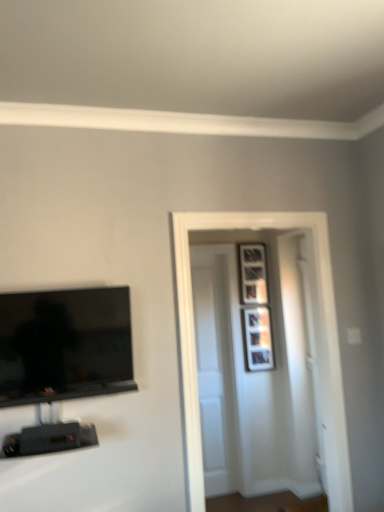
The image size is (384, 512). What do you see at coordinates (215, 369) in the screenshot?
I see `white wooden door at center, positioned as the first door in back-to-front order` at bounding box center [215, 369].

In order to face white glossy door at center, arranged as the 2th door when viewed from the back, should I rotate leftwards or rightwards?

A 9.481 degree turn to the right will do.

The height and width of the screenshot is (512, 384). Describe the element at coordinates (253, 274) in the screenshot. I see `wooden picture frame at upper right, placed as the first picture frame when sorted from top to bottom` at that location.

The image size is (384, 512). Describe the element at coordinates (258, 338) in the screenshot. I see `matte silver picture frame at upper right, which is counted as the second picture frame, starting from the top` at that location.

Where is `black glossy tv at left`? black glossy tv at left is located at coordinates pos(64,345).

Where is `white wooden door at center, positioned as the first door in back-to-front order`? white wooden door at center, positioned as the first door in back-to-front order is located at coordinates (215, 369).

Based on the photo, which object is more forward, matte silver picture frame at upper right, which is counted as the second picture frame, starting from the top, or white wooden door at center, positioned as the first door in back-to-front order?

white wooden door at center, positioned as the first door in back-to-front order, is in front.

Can you confirm if matte silver picture frame at upper right, marked as the first picture frame in a bottom-to-top arrangement, is positioned to the right of white wooden door at center, marked as the second door in a front-to-back arrangement?

Yes, matte silver picture frame at upper right, marked as the first picture frame in a bottom-to-top arrangement, is to the right of white wooden door at center, marked as the second door in a front-to-back arrangement.

Is matte silver picture frame at upper right, which is counted as the second picture frame, starting from the top, not near white wooden door at center, positioned as the first door in back-to-front order?

They are positioned close to each other.

Looking at this image, from a real-world perspective, is matte silver picture frame at upper right, marked as the first picture frame in a bottom-to-top arrangement, positioned above or below white wooden door at center, positioned as the first door in back-to-front order?

Clearly, from a real-world perspective, matte silver picture frame at upper right, marked as the first picture frame in a bottom-to-top arrangement, is above white wooden door at center, positioned as the first door in back-to-front order.

Which object is more forward, white wooden door at center, positioned as the first door in back-to-front order, or white glossy door at center, arranged as the 2th door when viewed from the back?

white glossy door at center, arranged as the 2th door when viewed from the back.

From the image's perspective, does white wooden door at center, marked as the second door in a front-to-back arrangement, appear higher than white glossy door at center, arranged as the 2th door when viewed from the back?

No, from the image's perspective, white wooden door at center, marked as the second door in a front-to-back arrangement, is not on top of white glossy door at center, arranged as the 2th door when viewed from the back.

How many degrees apart are the facing directions of white wooden door at center, positioned as the first door in back-to-front order, and white glossy door at center, arranged as the 2th door when viewed from the back?

1.2 degrees separate the facing orientations of white wooden door at center, positioned as the first door in back-to-front order, and white glossy door at center, arranged as the 2th door when viewed from the back.

From the picture: Is white wooden door at center, positioned as the first door in back-to-front order, next to white glossy door at center, the first door viewed from the front?

No, white wooden door at center, positioned as the first door in back-to-front order, is not with white glossy door at center, the first door viewed from the front.

From the picture: Can you see black glossy tv at left touching matte silver picture frame at upper right, marked as the first picture frame in a bottom-to-top arrangement?

No, black glossy tv at left is not next to matte silver picture frame at upper right, marked as the first picture frame in a bottom-to-top arrangement.

Is black glossy tv at left facing towards matte silver picture frame at upper right, marked as the first picture frame in a bottom-to-top arrangement?

No, black glossy tv at left is not turned towards matte silver picture frame at upper right, marked as the first picture frame in a bottom-to-top arrangement.

Which is more to the right, black glossy tv at left or matte silver picture frame at upper right, which is counted as the second picture frame, starting from the top?

Positioned to the right is matte silver picture frame at upper right, which is counted as the second picture frame, starting from the top.

What's the angular difference between black glossy tv at left and matte silver picture frame at upper right, which is counted as the second picture frame, starting from the top,'s facing directions?

The angle between the facing direction of black glossy tv at left and the facing direction of matte silver picture frame at upper right, which is counted as the second picture frame, starting from the top, is 4.7 degrees.

From the image's perspective, which one is positioned lower, wooden picture frame at upper right, placed as the first picture frame when sorted from top to bottom, or white wooden door at center, marked as the second door in a front-to-back arrangement?

white wooden door at center, marked as the second door in a front-to-back arrangement, is shown below in the image.

Looking at this image, which is less distant, (256, 298) or (210, 460)?

Point (256, 298) is farther from the camera than point (210, 460).

Is wooden picture frame at upper right, acting as the second picture frame starting from the bottom, facing away from white wooden door at center, marked as the second door in a front-to-back arrangement?

That's not correct — wooden picture frame at upper right, acting as the second picture frame starting from the bottom, is not looking away from white wooden door at center, marked as the second door in a front-to-back arrangement.

In the image, is wooden picture frame at upper right, acting as the second picture frame starting from the bottom, positioned in front of or behind white wooden door at center, marked as the second door in a front-to-back arrangement?

In the image, wooden picture frame at upper right, acting as the second picture frame starting from the bottom, appears behind white wooden door at center, marked as the second door in a front-to-back arrangement.

From the image's perspective, would you say white wooden door at center, positioned as the first door in back-to-front order, is shown under matte silver picture frame at upper right, which is counted as the second picture frame, starting from the top?

Indeed, from the image's perspective, white wooden door at center, positioned as the first door in back-to-front order, is shown beneath matte silver picture frame at upper right, which is counted as the second picture frame, starting from the top.

In terms of width, does white wooden door at center, marked as the second door in a front-to-back arrangement, look wider or thinner when compared to matte silver picture frame at upper right, marked as the first picture frame in a bottom-to-top arrangement?

white wooden door at center, marked as the second door in a front-to-back arrangement, is wider than matte silver picture frame at upper right, marked as the first picture frame in a bottom-to-top arrangement.

Would you say white wooden door at center, marked as the second door in a front-to-back arrangement, is inside or outside matte silver picture frame at upper right, which is counted as the second picture frame, starting from the top?

white wooden door at center, marked as the second door in a front-to-back arrangement, is not enclosed by matte silver picture frame at upper right, which is counted as the second picture frame, starting from the top.

From the image's perspective, which one is positioned higher, white wooden door at center, positioned as the first door in back-to-front order, or black glossy tv at left?

black glossy tv at left appears higher in the image.

Is point (218, 362) positioned after point (34, 345)?

Yes, it is behind point (34, 345).

Considering the positions of objects white wooden door at center, marked as the second door in a front-to-back arrangement, and black glossy tv at left in the image provided, who is more to the right, white wooden door at center, marked as the second door in a front-to-back arrangement, or black glossy tv at left?

white wooden door at center, marked as the second door in a front-to-back arrangement, is more to the right.

Does white wooden door at center, marked as the second door in a front-to-back arrangement, contain black glossy tv at left?

Definitely not — black glossy tv at left is not inside white wooden door at center, marked as the second door in a front-to-back arrangement.

Is the depth of wooden picture frame at upper right, acting as the second picture frame starting from the bottom, less than that of white glossy door at center, arranged as the 2th door when viewed from the back?

No, wooden picture frame at upper right, acting as the second picture frame starting from the bottom, is further to the viewer.

The width and height of the screenshot is (384, 512). In order to click on the 2nd picture frame above the white glossy door at center, the first door viewed from the front (from a real-world perspective) in this screenshot , I will do `click(253, 274)`.

From the image's perspective, is wooden picture frame at upper right, acting as the second picture frame starting from the bottom, above or below white glossy door at center, arranged as the 2th door when viewed from the back?

wooden picture frame at upper right, acting as the second picture frame starting from the bottom, is situated higher than white glossy door at center, arranged as the 2th door when viewed from the back, in the image.

Is white glossy door at center, arranged as the 2th door when viewed from the back, at the back of wooden picture frame at upper right, placed as the first picture frame when sorted from top to bottom?

No, wooden picture frame at upper right, placed as the first picture frame when sorted from top to bottom,'s orientation is not away from white glossy door at center, arranged as the 2th door when viewed from the back.

At what (x,y) coordinates should I click in order to perform the action: click on door below the matte silver picture frame at upper right, which is counted as the second picture frame, starting from the top (from the image's perspective). Please return your answer as a coordinate pair (x, y). Looking at the image, I should click on (215, 369).

This screenshot has height=512, width=384. What are the coordinates of `door above the white wooden door at center, marked as the second door in a front-to-back arrangement (from the image's perspective)` in the screenshot? It's located at (193, 317).

When comparing their distances from white wooden door at center, positioned as the first door in back-to-front order, does black glossy tv at left or matte silver picture frame at upper right, which is counted as the second picture frame, starting from the top, seem closer?

matte silver picture frame at upper right, which is counted as the second picture frame, starting from the top, is positioned closer to the anchor white wooden door at center, positioned as the first door in back-to-front order.

Based on their spatial positions, is white wooden door at center, marked as the second door in a front-to-back arrangement, or white glossy door at center, arranged as the 2th door when viewed from the back, closer to wooden picture frame at upper right, placed as the first picture frame when sorted from top to bottom?

The object closer to wooden picture frame at upper right, placed as the first picture frame when sorted from top to bottom, is white wooden door at center, marked as the second door in a front-to-back arrangement.

When comparing their distances from black glossy tv at left, does wooden picture frame at upper right, acting as the second picture frame starting from the bottom, or matte silver picture frame at upper right, which is counted as the second picture frame, starting from the top, seem closer?

matte silver picture frame at upper right, which is counted as the second picture frame, starting from the top, is positioned closer to the anchor black glossy tv at left.

From the image, which object appears to be nearer to black glossy tv at left, matte silver picture frame at upper right, which is counted as the second picture frame, starting from the top, or white glossy door at center, the first door viewed from the front?

white glossy door at center, the first door viewed from the front, is positioned closer to the anchor black glossy tv at left.

In the scene shown: Considering their positions, is matte silver picture frame at upper right, which is counted as the second picture frame, starting from the top, positioned closer to wooden picture frame at upper right, placed as the first picture frame when sorted from top to bottom, than white glossy door at center, the first door viewed from the front?

matte silver picture frame at upper right, which is counted as the second picture frame, starting from the top, is positioned closer to the anchor wooden picture frame at upper right, placed as the first picture frame when sorted from top to bottom.

From the image, which object appears to be nearer to white wooden door at center, marked as the second door in a front-to-back arrangement, black glossy tv at left or wooden picture frame at upper right, acting as the second picture frame starting from the bottom?

The object closer to white wooden door at center, marked as the second door in a front-to-back arrangement, is wooden picture frame at upper right, acting as the second picture frame starting from the bottom.

Looking at the image, which one is located further to wooden picture frame at upper right, placed as the first picture frame when sorted from top to bottom, black glossy tv at left or matte silver picture frame at upper right, marked as the first picture frame in a bottom-to-top arrangement?

black glossy tv at left is positioned further to the anchor wooden picture frame at upper right, placed as the first picture frame when sorted from top to bottom.

Which object lies further to the anchor point black glossy tv at left, white glossy door at center, arranged as the 2th door when viewed from the back, or wooden picture frame at upper right, acting as the second picture frame starting from the bottom?

wooden picture frame at upper right, acting as the second picture frame starting from the bottom, is further to black glossy tv at left.

Locate an element on the screen. Image resolution: width=384 pixels, height=512 pixels. door between white glossy door at center, arranged as the 2th door when viewed from the back, and matte silver picture frame at upper right, which is counted as the second picture frame, starting from the top, from front to back is located at coordinates (215, 369).

Identify the location of picture frame between black glossy tv at left and wooden picture frame at upper right, acting as the second picture frame starting from the bottom, along the z-axis. (258, 338).

Where is `door located between black glossy tv at left and white wooden door at center, positioned as the first door in back-to-front order, in the depth direction`? This screenshot has width=384, height=512. door located between black glossy tv at left and white wooden door at center, positioned as the first door in back-to-front order, in the depth direction is located at coordinates (193, 317).

This screenshot has height=512, width=384. Find the location of `picture frame between white glossy door at center, arranged as the 2th door when viewed from the back, and wooden picture frame at upper right, placed as the first picture frame when sorted from top to bottom, along the z-axis`. picture frame between white glossy door at center, arranged as the 2th door when viewed from the back, and wooden picture frame at upper right, placed as the first picture frame when sorted from top to bottom, along the z-axis is located at coordinates (258, 338).